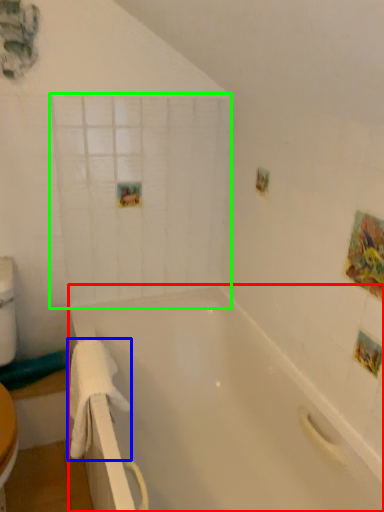
Question: Which is nearer to the bathtub (highlighted by a red box)? towel/napkin (highlighted by a blue box) or glass door (highlighted by a green box).

Choices:
 (A) towel/napkin
 (B) glass door

Answer: (A)